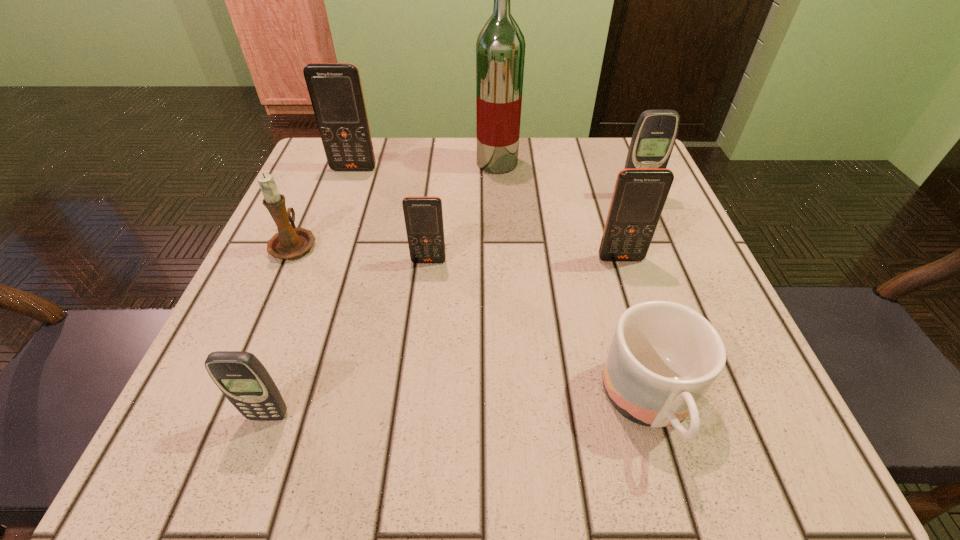
Identify the location of the left gray cellular telephone. The image size is (960, 540). (242, 378).

What are the coordinates of `the nearest cellular telephone` in the screenshot? It's located at pos(242,378).

Image resolution: width=960 pixels, height=540 pixels. What are the coordinates of `mug` in the screenshot? It's located at (664, 356).

Locate an element on the screen. The width and height of the screenshot is (960, 540). blue mug is located at coordinates (664, 356).

This screenshot has height=540, width=960. Identify the location of free location located on the left of the liquor. (400, 163).

At what (x,y) coordinates should I click in order to perform the action: click on free space located 0.330m on the screen of the biggest orange cellular telephone. Please return your answer as a coordinate pair (x, y). Looking at the image, I should click on (313, 283).

At what (x,y) coordinates should I click in order to perform the action: click on vacant point located 0.260m on the screen of the bigger gray cellular telephone. Please return your answer as a coordinate pair (x, y). The height and width of the screenshot is (540, 960). Looking at the image, I should click on (678, 294).

At what (x,y) coordinates should I click in order to perform the action: click on vacant space located on the screen of the second smallest orange cellular telephone. Please return your answer as a coordinate pair (x, y). Image resolution: width=960 pixels, height=540 pixels. Looking at the image, I should click on (654, 361).

Locate an element on the screen. This screenshot has width=960, height=540. vacant region located 0.100m on the side of the candle holder with the handle is located at coordinates (316, 194).

Where is `vacant space situated 0.250m on the side of the candle holder with the handle`? vacant space situated 0.250m on the side of the candle holder with the handle is located at coordinates (333, 156).